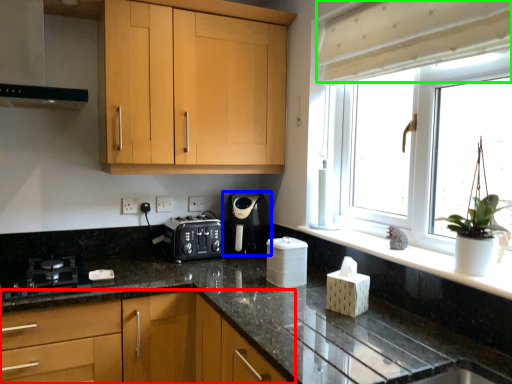
Question: Which object is positioned farthest from cabinetry (highlighted by a red box)? Select from kitchen appliance (highlighted by a blue box) and curtain (highlighted by a green box).

Choices:
 (A) kitchen appliance
 (B) curtain

Answer: (B)